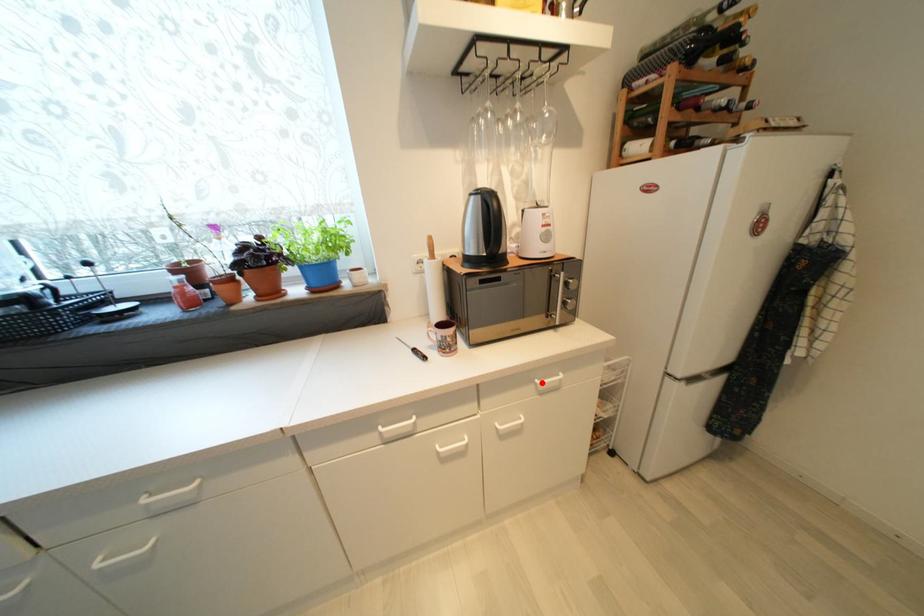
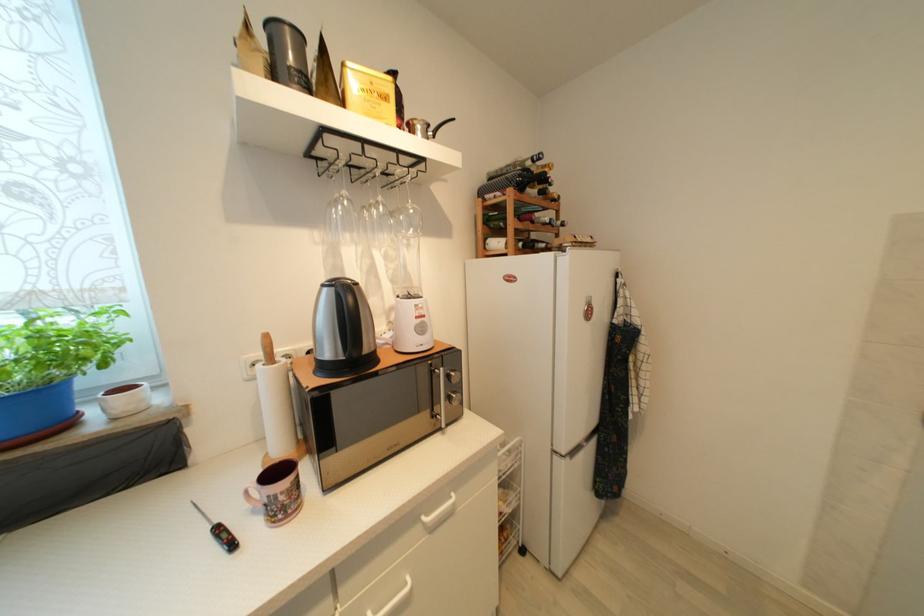
Where in the second image is the point corresponding to the highlighted location from the first image?

(429, 521)